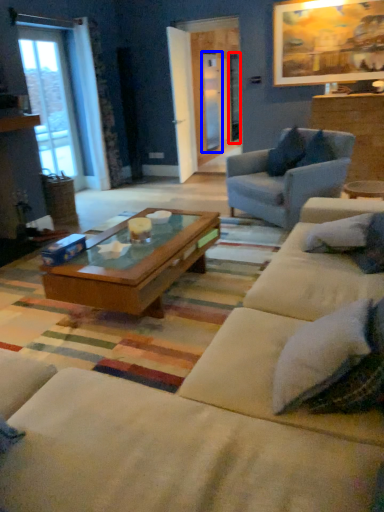
Question: Which object appears farthest to the camera in this image, screen door (highlighted by a red box) or screen door (highlighted by a blue box)?

Choices:
 (A) screen door
 (B) screen door

Answer: (A)